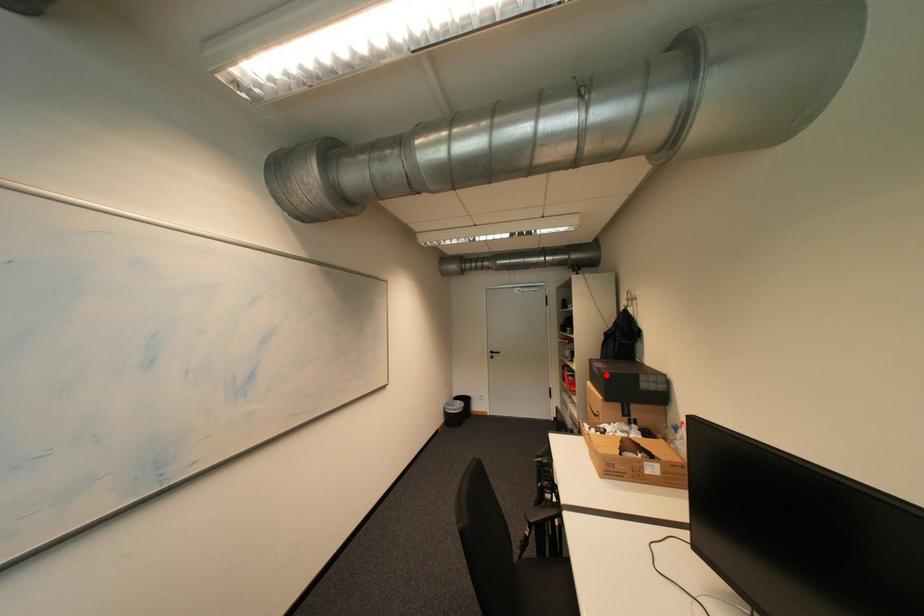
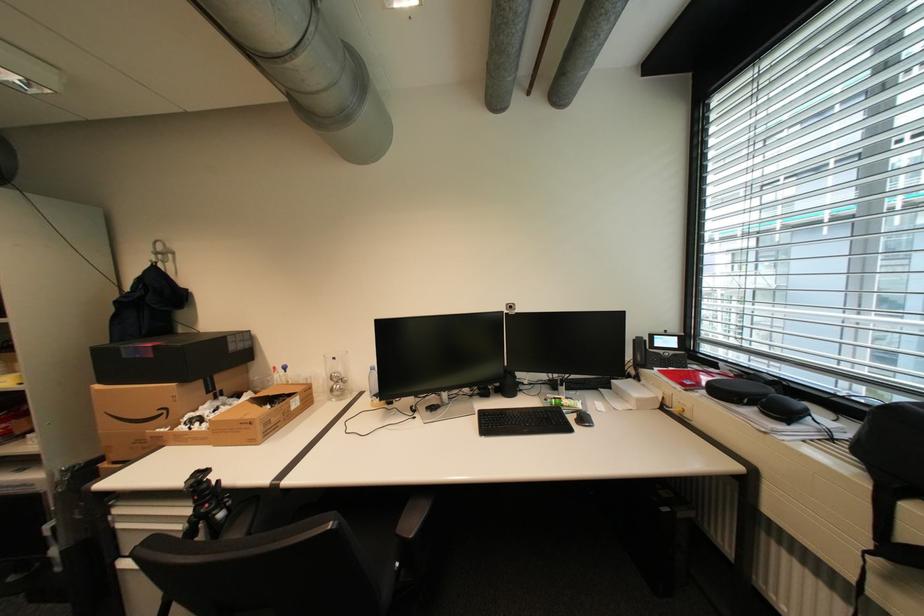
Where in the second image is the point corresponding to the highlighted location from the first image?

(161, 357)